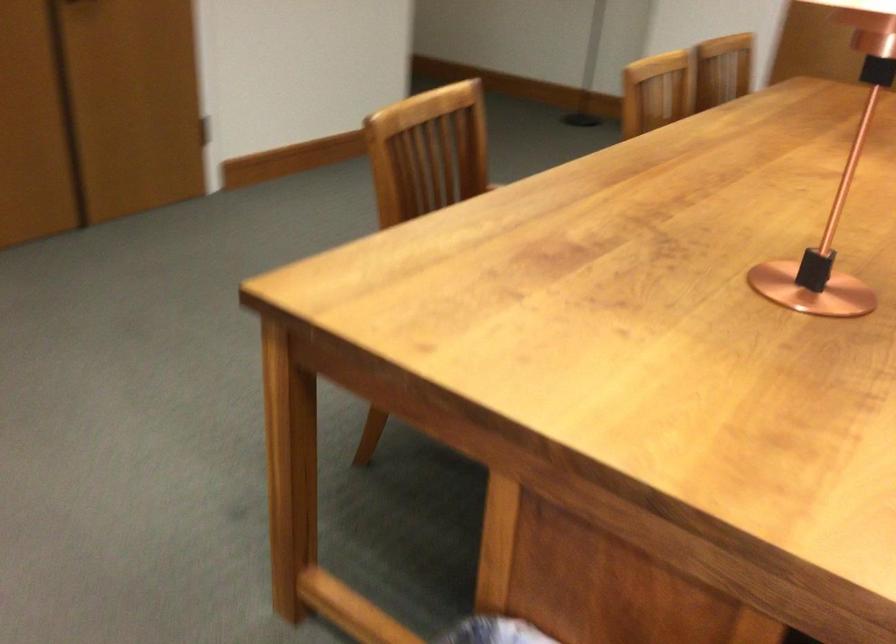
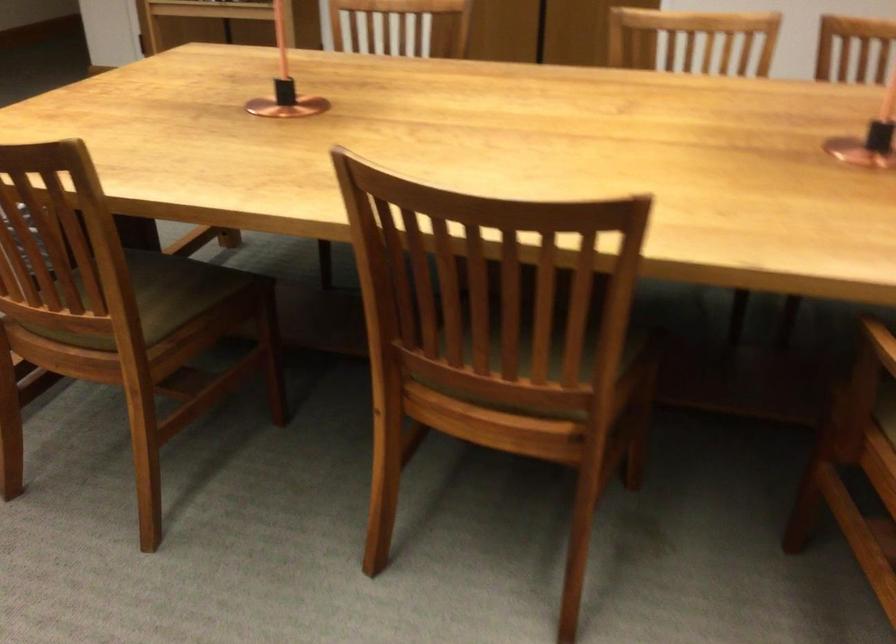
Locate, in the second image, the point that corresponds to the point at 819,257 in the first image.

(285, 84)